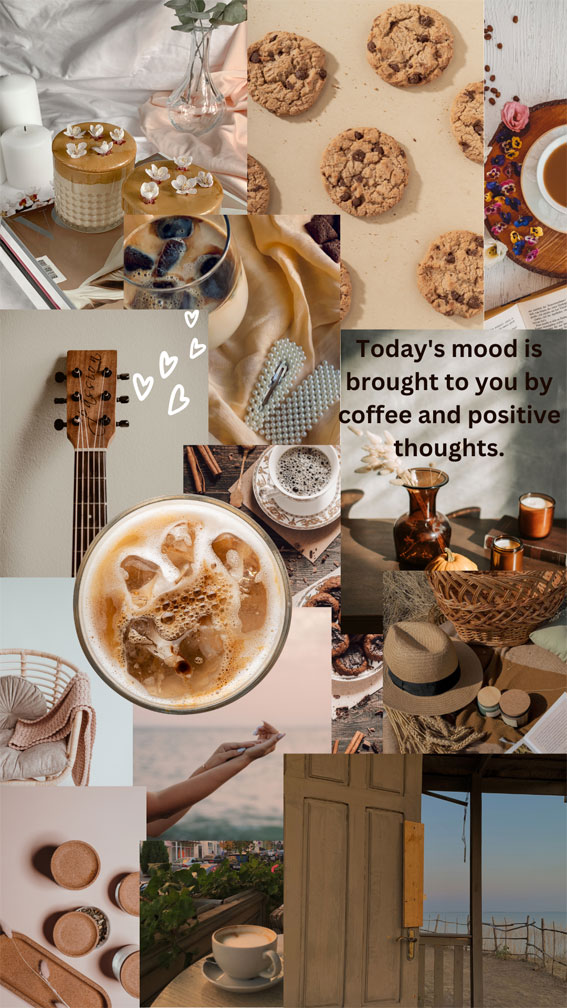
Find the location of a particular element. The width and height of the screenshot is (567, 1008). candles is located at coordinates (29, 92), (36, 147), (541, 507), (507, 547).